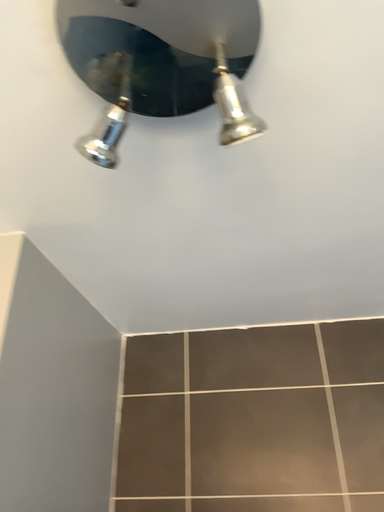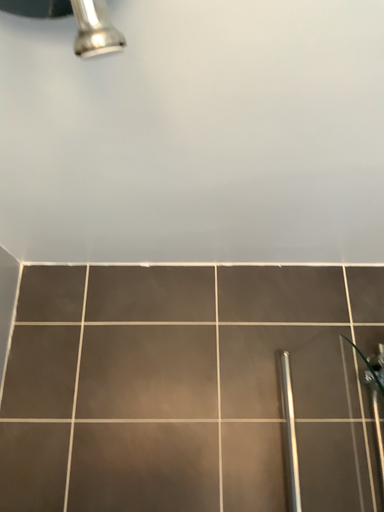
Question: How did the camera likely rotate when shooting the video?

Choices:
 (A) rotated right
 (B) rotated left

Answer: (A)